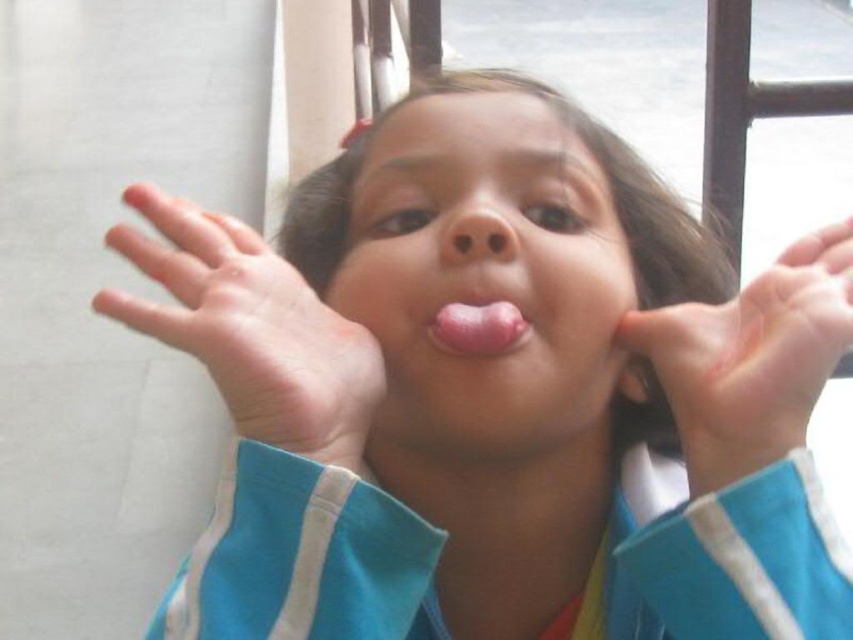
Question: Does smooth skin face at center have a greater width compared to pale skin hand at center?

Choices:
 (A) no
 (B) yes

Answer: (B)

Question: Which object appears closest to the camera in this image?

Choices:
 (A) pale skin hand at center
 (B) pink matte nose at center
 (C) pink flesh-colored tongue at center
 (D) smooth skin face at center

Answer: (A)

Question: Which point is farther to the camera?

Choices:
 (A) pink flesh-colored tongue at center
 (B) pink matte nose at center
 (C) smooth skin hand at center
 (D) smooth skin face at center

Answer: (B)

Question: Is smooth skin hand at center above pink flesh-colored tongue at center?

Choices:
 (A) yes
 (B) no

Answer: (A)

Question: Can you confirm if smooth skin face at center is positioned above pink matte nose at center?

Choices:
 (A) no
 (B) yes

Answer: (A)

Question: Which point is farther to the camera?

Choices:
 (A) (633, 312)
 (B) (491, 314)
 (C) (303, 362)

Answer: (A)